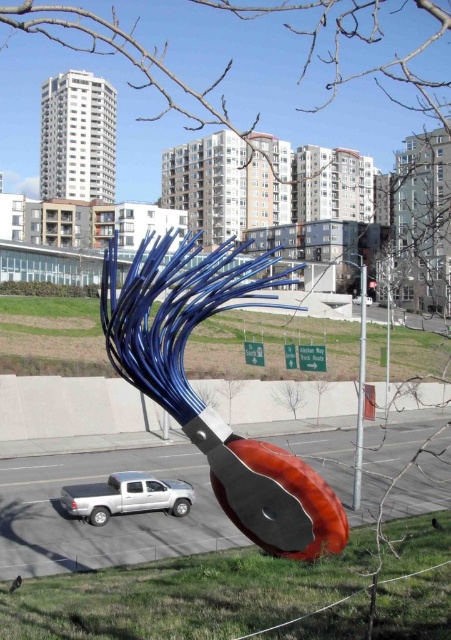
You are a pedestrian standing at the edge of the road. You see a metallic silver pole at center and a white glossy car at center. If the car is moving towards the pole, will it hit the pole?

The metallic silver pole at center and white glossy car at center are 5.36 meters apart. Since the car is moving towards the pole, there is a distance of 5.36 meters between them, so the car will hit the pole if it continues moving in that direction without stopping.